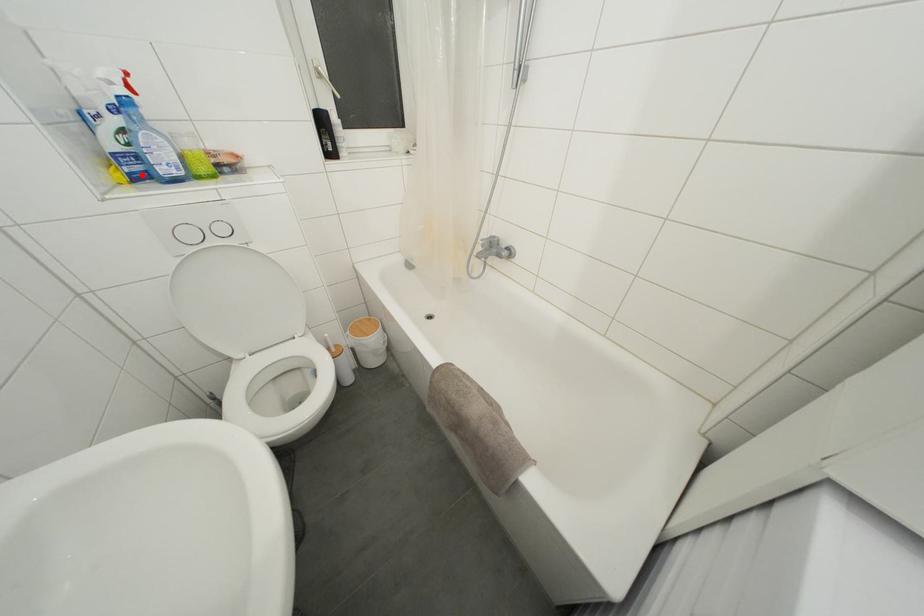
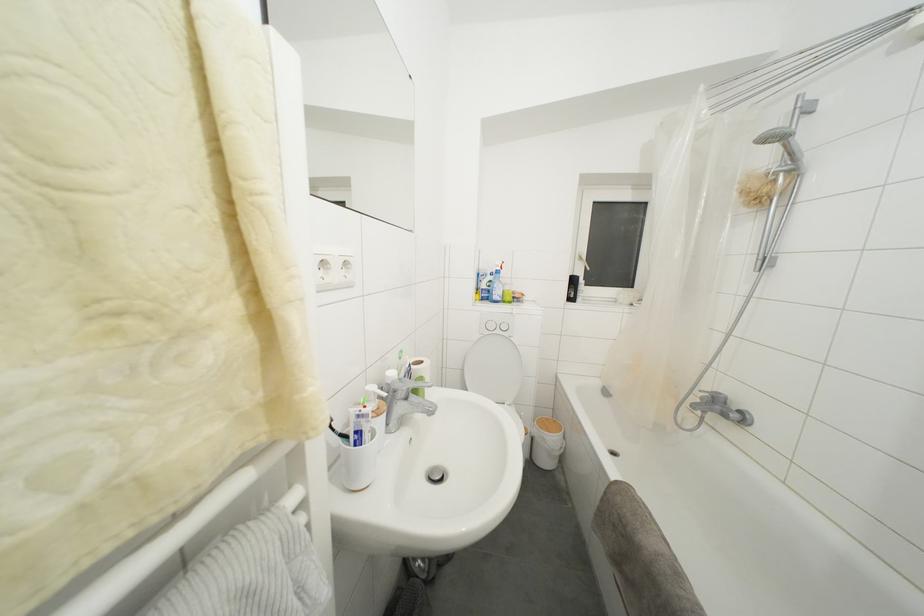
Locate, in the second image, the point that corresponds to the highlighted location in the first image.

(490, 301)